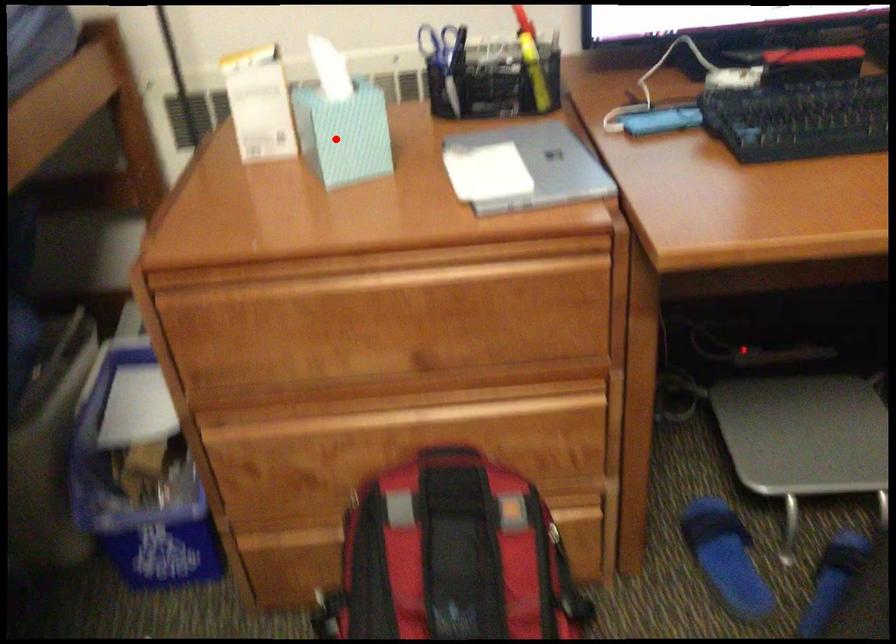
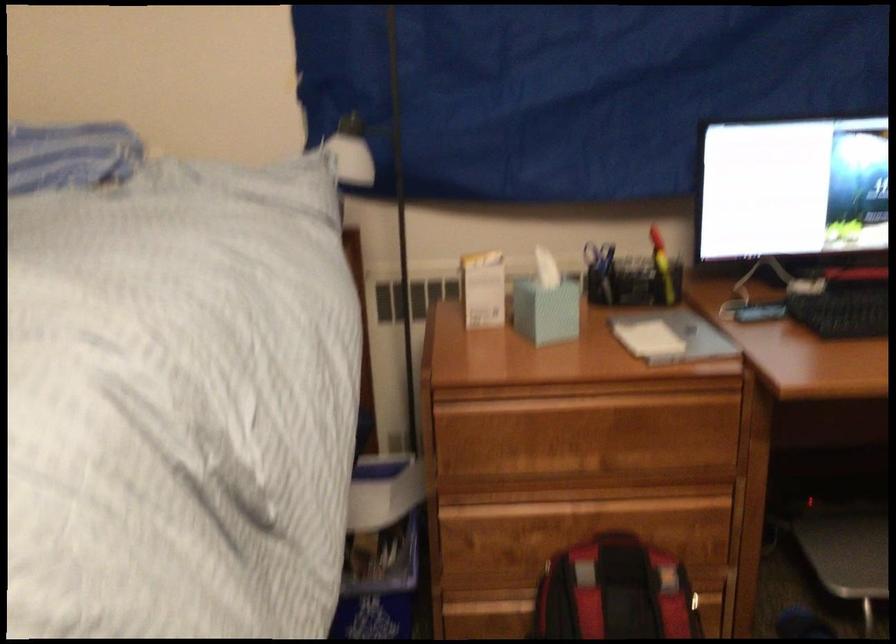
Question: I am providing you with two images of the same scene from different viewpoints. In image1, a red point is highlighted. Considering the same 3D point in image2, which of the following is correct?

Choices:
 (A) It is closer
 (B) It is farther

Answer: (B)